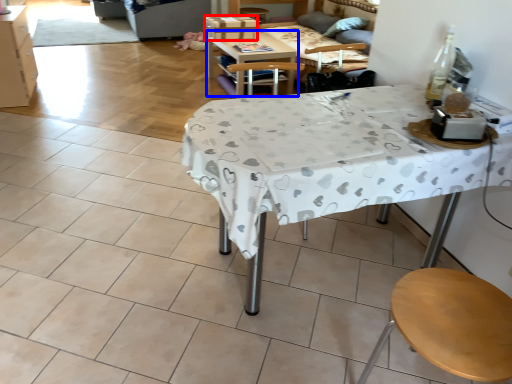
Question: Which object appears farthest to the camera in this image, box (highlighted by a red box) or table (highlighted by a blue box)?

Choices:
 (A) box
 (B) table

Answer: (A)